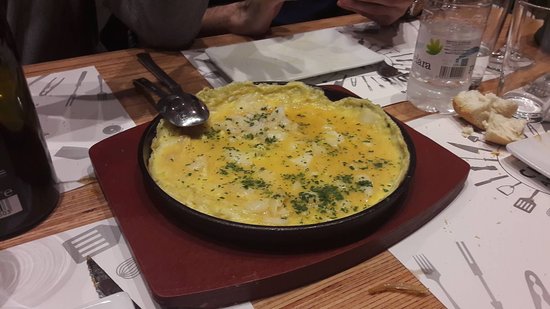
Locate an element on the screen. glass is located at coordinates (32, 130).